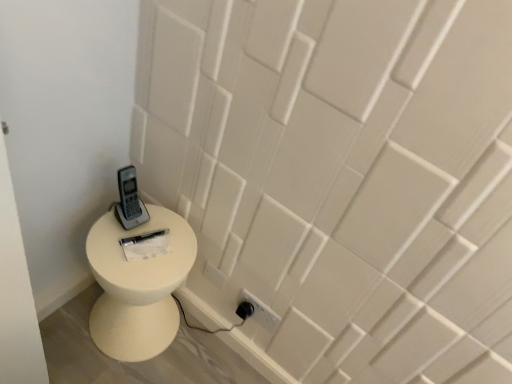
Question: Can you confirm if gray plastic phone at upper left is shorter than white matte toilet at lower left?

Choices:
 (A) no
 (B) yes

Answer: (B)

Question: From the image's perspective, is gray plastic phone at upper left under white matte toilet at lower left?

Choices:
 (A) no
 (B) yes

Answer: (A)

Question: Is gray plastic phone at upper left not within white matte toilet at lower left?

Choices:
 (A) yes
 (B) no

Answer: (A)

Question: From a real-world perspective, does gray plastic phone at upper left stand above white matte toilet at lower left?

Choices:
 (A) yes
 (B) no

Answer: (A)

Question: Is gray plastic phone at upper left in contact with white matte toilet at lower left?

Choices:
 (A) no
 (B) yes

Answer: (A)

Question: Is gray plastic phone at upper left not close to white matte toilet at lower left?

Choices:
 (A) yes
 (B) no

Answer: (B)

Question: Is white matte toilet at lower left looking in the opposite direction of gray plastic phone at upper left?

Choices:
 (A) yes
 (B) no

Answer: (B)

Question: Can you confirm if white matte toilet at lower left is taller than gray plastic phone at upper left?

Choices:
 (A) yes
 (B) no

Answer: (A)

Question: From a real-world perspective, is white matte toilet at lower left located higher than gray plastic phone at upper left?

Choices:
 (A) no
 (B) yes

Answer: (A)

Question: Considering the relative sizes of white matte toilet at lower left and gray plastic phone at upper left in the image provided, is white matte toilet at lower left bigger than gray plastic phone at upper left?

Choices:
 (A) yes
 (B) no

Answer: (A)

Question: From a real-world perspective, is white matte toilet at lower left under gray plastic phone at upper left?

Choices:
 (A) no
 (B) yes

Answer: (B)

Question: Can you confirm if white matte toilet at lower left is positioned to the right of gray plastic phone at upper left?

Choices:
 (A) yes
 (B) no

Answer: (B)

Question: In terms of height, does gray plastic phone at upper left look taller or shorter compared to white matte toilet at lower left?

Choices:
 (A) short
 (B) tall

Answer: (A)